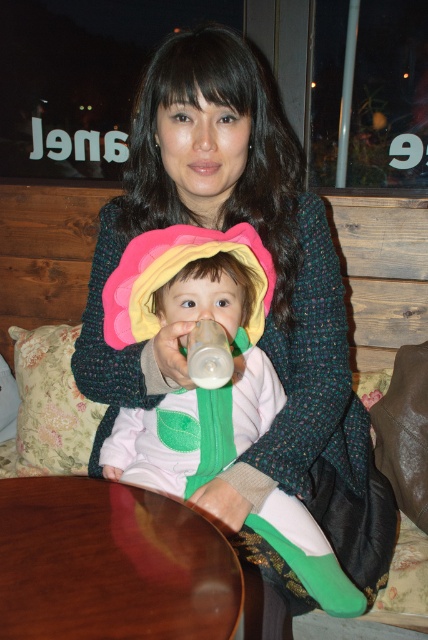
How distant is soft pink fabric flower at center from shiny brown wood at lower center?

soft pink fabric flower at center is 8.61 inches away from shiny brown wood at lower center.

Is soft pink fabric flower at center shorter than shiny brown wood at lower center?

No, soft pink fabric flower at center is not shorter than shiny brown wood at lower center.

Is point (252, 364) farther from viewer compared to point (30, 520)?

That is True.

What are the coordinates of `soft pink fabric flower at center` in the screenshot? It's located at (172, 326).

Between soft pink fabric flower at center and transparent plastic bottle at center, which one appears on the right side from the viewer's perspective?

transparent plastic bottle at center is more to the right.

Is soft pink fabric flower at center smaller than transparent plastic bottle at center?

Actually, soft pink fabric flower at center might be larger than transparent plastic bottle at center.

Is point (216, 250) farther from camera compared to point (193, 365)?

Yes, it is behind point (193, 365).

The height and width of the screenshot is (640, 428). What are the coordinates of `soft pink fabric flower at center` in the screenshot? It's located at (172, 326).

Does shiny brown wood at lower center lie behind transparent plastic bottle at center?

No, shiny brown wood at lower center is closer to the viewer.

Consider the image. Between shiny brown wood at lower center and transparent plastic bottle at center, which one has less height?

Standing shorter between the two is transparent plastic bottle at center.

Is point (76, 547) positioned after point (187, 344)?

That is True.

This screenshot has width=428, height=640. In order to click on shiny brown wood at lower center in this screenshot , I will do `click(110, 564)`.